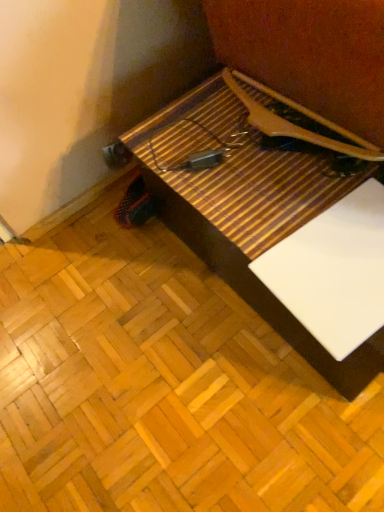
Locate an element on the screen. Image resolution: width=384 pixels, height=512 pixels. free space above white matte paper at lower right (from a real-world perspective) is located at coordinates (340, 260).